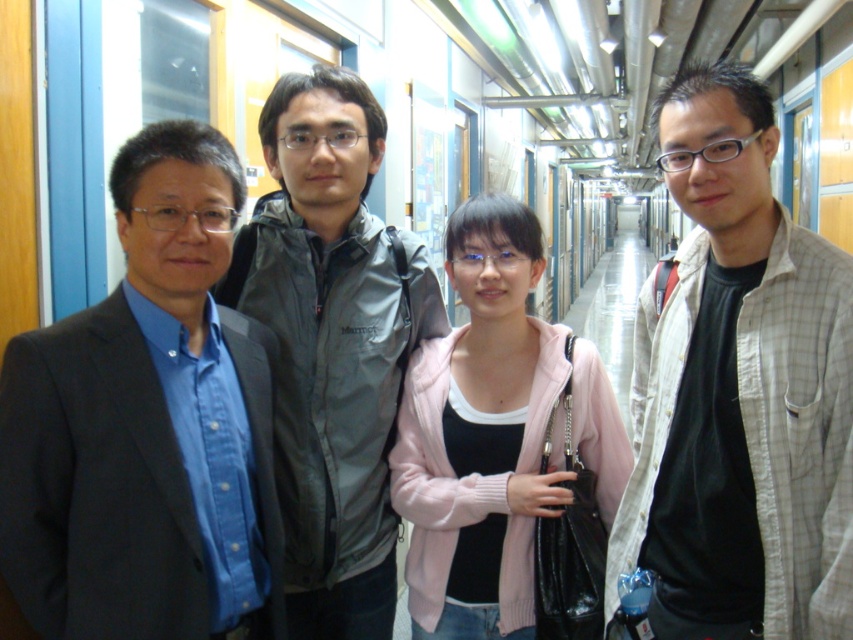
Question: Can you confirm if gray matte jacket at center is positioned below pink knitted sweater at center?

Choices:
 (A) yes
 (B) no

Answer: (B)

Question: Can you confirm if matte black suit at left is smaller than white checkered shirt at right?

Choices:
 (A) no
 (B) yes

Answer: (B)

Question: Can you confirm if matte black suit at left is thinner than gray matte jacket at center?

Choices:
 (A) no
 (B) yes

Answer: (B)

Question: Which object is positioned farthest from the gray matte jacket at center?

Choices:
 (A) white checkered shirt at right
 (B) matte black suit at left

Answer: (A)

Question: Which object is farther from the camera taking this photo?

Choices:
 (A) gray matte jacket at center
 (B) white checkered shirt at right

Answer: (A)

Question: Which object is positioned farthest from the matte black suit at left?

Choices:
 (A) gray matte jacket at center
 (B) pink knitted sweater at center
 (C) white checkered shirt at right

Answer: (C)